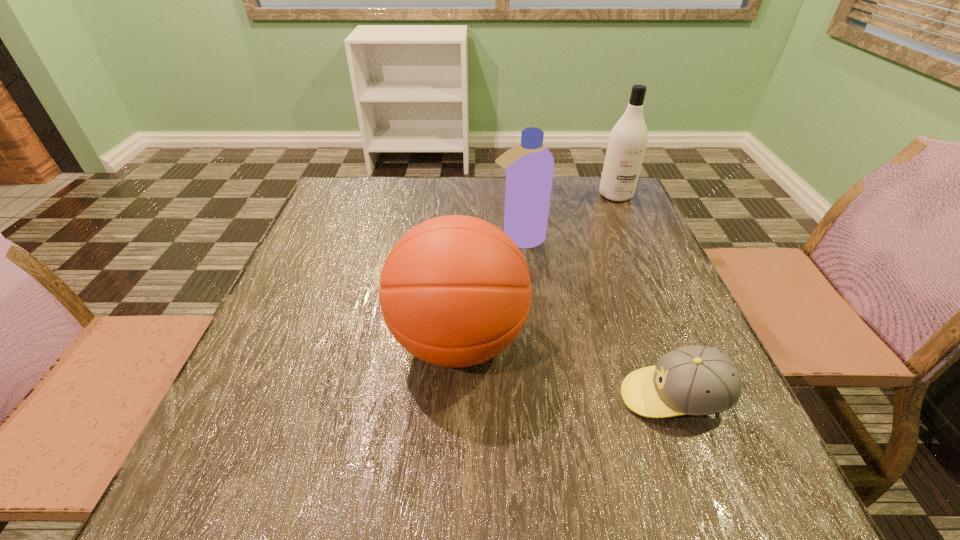
This screenshot has width=960, height=540. I want to click on empty space that is in between the farther shampoo and the shortest object, so click(x=645, y=296).

I want to click on unoccupied area between the baseball cap and the basketball, so click(x=566, y=369).

Where is `object that stands as the third closest to the baseball cap`? object that stands as the third closest to the baseball cap is located at coordinates (628, 139).

I want to click on the third closest object to the left shampoo, so click(x=695, y=380).

The height and width of the screenshot is (540, 960). Identify the location of vacant space that satisfies the following two spatial constraints: 1. on the front-facing side of the farther shampoo; 2. on the front-facing side of the shortest object. (707, 397).

This screenshot has width=960, height=540. What are the coordinates of `blank area in the image that satisfies the following two spatial constraints: 1. on the front-facing side of the right shampoo; 2. on the front-facing side of the baseball cap` in the screenshot? It's located at (707, 397).

I want to click on free space that satisfies the following two spatial constraints: 1. on the front-facing side of the farther shampoo; 2. on the front-facing side of the shortest object, so click(707, 397).